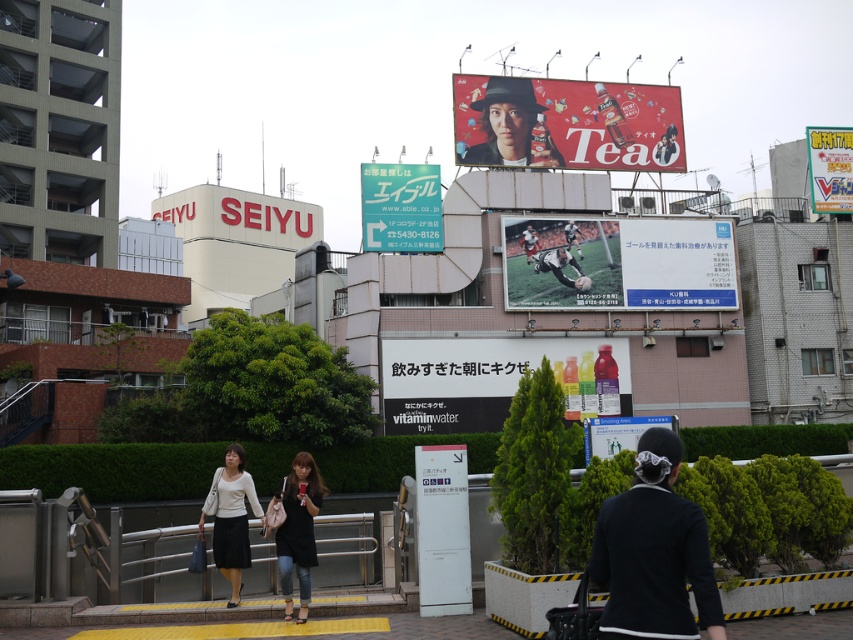
You are a pedestrian standing at the crosswalk in the scene. You see the denim jeans at center and the white plastic sign at center. Which object is located lower in the image?

The denim jeans at center is positioned under the white plastic sign at center, so it is located lower in the image.

You are a street artist planning to place a new poster that is 1.2 meters wide. You see the white paper poster at center and the matte black soccer player at upper center. Which existing poster can your new poster fit next to without overlapping?

The white paper poster at center has a larger width than the matte black soccer player at upper center, so your new 1.2 meter wide poster can fit next to the white paper poster at center since it is wider and provides more space.

You are a city planner assessing the visibility of signs in this area. Considering the bright yellow sign at upper right and the black leather soccer player at center, which one is wider?

The bright yellow sign at upper right is wider than the black leather soccer player at center, as its width surpasses the latter.